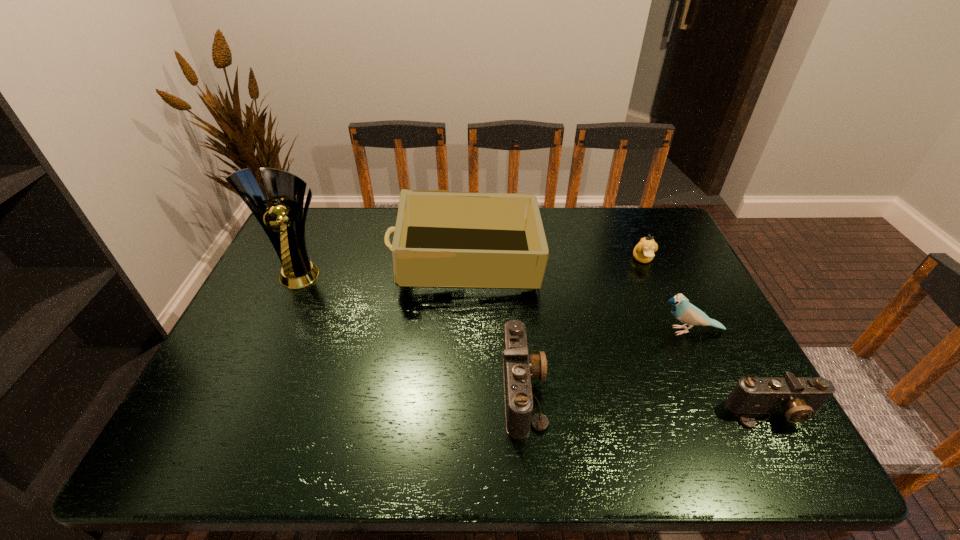
The image size is (960, 540). What are the coordinates of `free space located 0.300m at the front of the award, where the globe is visible` in the screenshot? It's located at (253, 375).

Where is `vacant space located 0.080m at the face of the third nearest object`? vacant space located 0.080m at the face of the third nearest object is located at coordinates (623, 330).

The height and width of the screenshot is (540, 960). In order to click on vacant space located 0.140m at the face of the third nearest object in this screenshot , I will do `click(600, 330)`.

Locate an element on the screen. The height and width of the screenshot is (540, 960). blank area located 0.060m at the face of the third nearest object is located at coordinates (631, 330).

Find the location of `box at the far edge`. box at the far edge is located at coordinates (442, 239).

Image resolution: width=960 pixels, height=540 pixels. Find the location of `duckling that is at the far edge`. duckling that is at the far edge is located at coordinates pos(643,252).

Identify the location of object present at the left edge. The height and width of the screenshot is (540, 960). (283, 221).

In order to click on camera that is at the right edge in this screenshot , I will do `click(799, 399)`.

Where is `duckling positioned at the right edge`? This screenshot has height=540, width=960. duckling positioned at the right edge is located at coordinates (643, 252).

The height and width of the screenshot is (540, 960). What are the coordinates of `bird positioned at the right edge` in the screenshot? It's located at (685, 312).